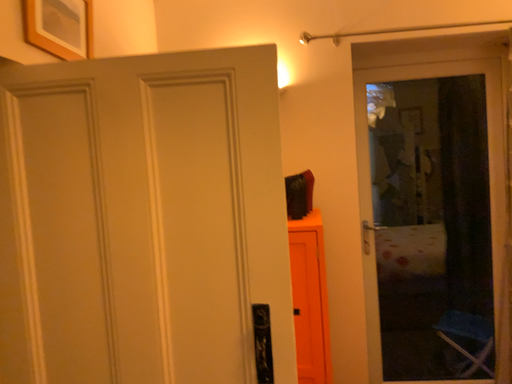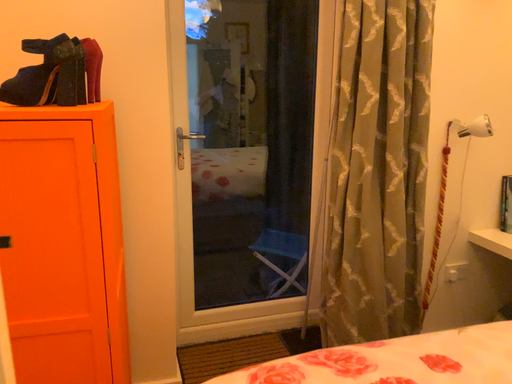
Question: How did the camera likely rotate when shooting the video?

Choices:
 (A) rotated right
 (B) rotated left

Answer: (A)